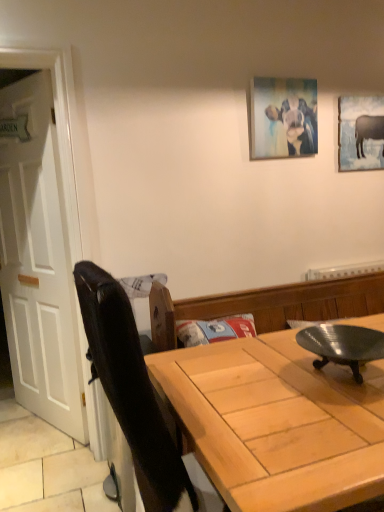
At what (x,y) coordinates should I click in order to perform the action: click on vacant point to the left of metallic silver plate at center. Please return your answer as a coordinate pair (x, y). This screenshot has height=512, width=384. Looking at the image, I should click on (258, 377).